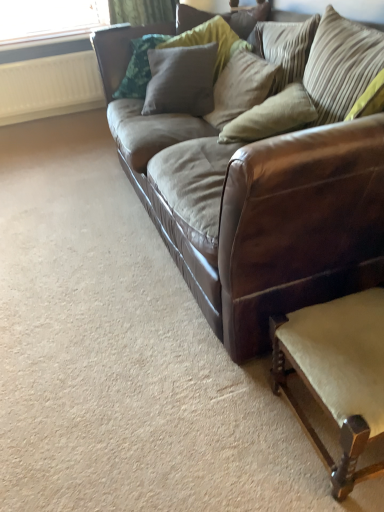
Question: Does textured beige pillow at upper center, which is the 2th pillow in left-to-right order, have a smaller size compared to striped fabric pillow at upper right, the fourth pillow positioned from the left?

Choices:
 (A) no
 (B) yes

Answer: (A)

Question: Does textured beige pillow at upper center, arranged as the 3th pillow when viewed from the right, have a lesser width compared to striped fabric pillow at upper right, placed as the 1th pillow when sorted from right to left?

Choices:
 (A) no
 (B) yes

Answer: (A)

Question: Would you consider textured beige pillow at upper center, which is the 2th pillow in left-to-right order, to be distant from striped fabric pillow at upper right, placed as the 1th pillow when sorted from right to left?

Choices:
 (A) no
 (B) yes

Answer: (A)

Question: Is textured beige pillow at upper center, which is the 2th pillow in left-to-right order, looking in the opposite direction of striped fabric pillow at upper right, the fourth pillow positioned from the left?

Choices:
 (A) yes
 (B) no

Answer: (A)

Question: Can you confirm if textured beige pillow at upper center, arranged as the 3th pillow when viewed from the right, is shorter than striped fabric pillow at upper right, placed as the 1th pillow when sorted from right to left?

Choices:
 (A) no
 (B) yes

Answer: (A)

Question: From a real-world perspective, is textured beige pillow at upper center, arranged as the 3th pillow when viewed from the right, positioned over striped fabric pillow at upper right, placed as the 1th pillow when sorted from right to left, based on gravity?

Choices:
 (A) yes
 (B) no

Answer: (B)

Question: Is textured beige pillow at upper center, arranged as the 3th pillow when viewed from the right, smaller than light beige fabric swivel chair at lower right?

Choices:
 (A) no
 (B) yes

Answer: (A)

Question: Is light beige fabric swivel chair at lower right at the back of textured beige pillow at upper center, arranged as the 3th pillow when viewed from the right?

Choices:
 (A) no
 (B) yes

Answer: (A)

Question: From a real-world perspective, does textured beige pillow at upper center, arranged as the 3th pillow when viewed from the right, stand above light beige fabric swivel chair at lower right?

Choices:
 (A) yes
 (B) no

Answer: (A)

Question: From a real-world perspective, is textured beige pillow at upper center, arranged as the 3th pillow when viewed from the right, located beneath light beige fabric swivel chair at lower right?

Choices:
 (A) yes
 (B) no

Answer: (B)

Question: Can you confirm if textured beige pillow at upper center, which is the 2th pillow in left-to-right order, is shorter than light beige fabric swivel chair at lower right?

Choices:
 (A) yes
 (B) no

Answer: (B)

Question: Could you tell me if textured beige pillow at upper center, arranged as the 3th pillow when viewed from the right, is facing light beige fabric swivel chair at lower right?

Choices:
 (A) yes
 (B) no

Answer: (B)

Question: Could you tell me if beige fabric pillow at center, the third pillow positioned from the left, is turned towards striped fabric pillow at upper right, placed as the 1th pillow when sorted from right to left?

Choices:
 (A) yes
 (B) no

Answer: (B)